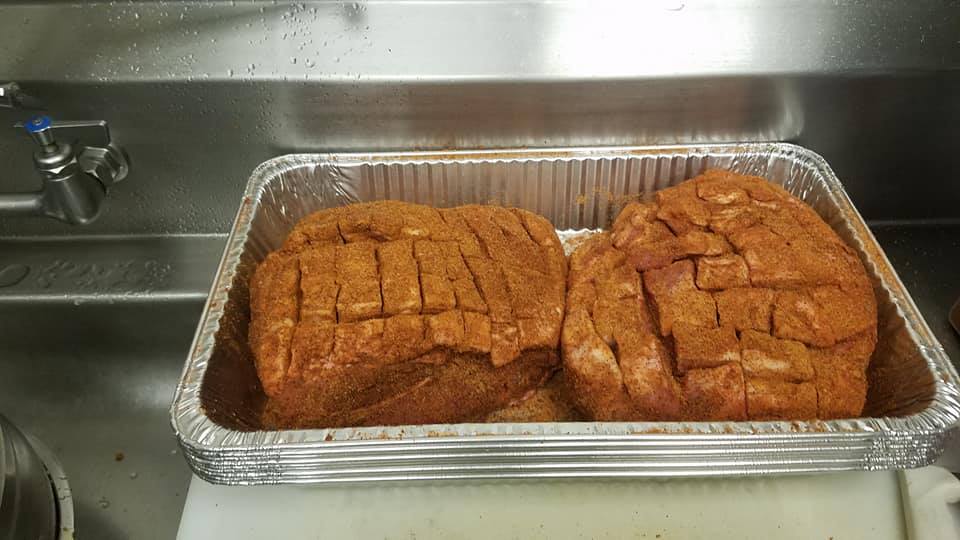
At what (x,y) coordinates should I click in order to perform the action: click on roasting board is sitting on top of this white plastic board. Please return your answer as a coordinate pair (x, y). Looking at the image, I should click on (282, 507), (574, 515), (872, 497).